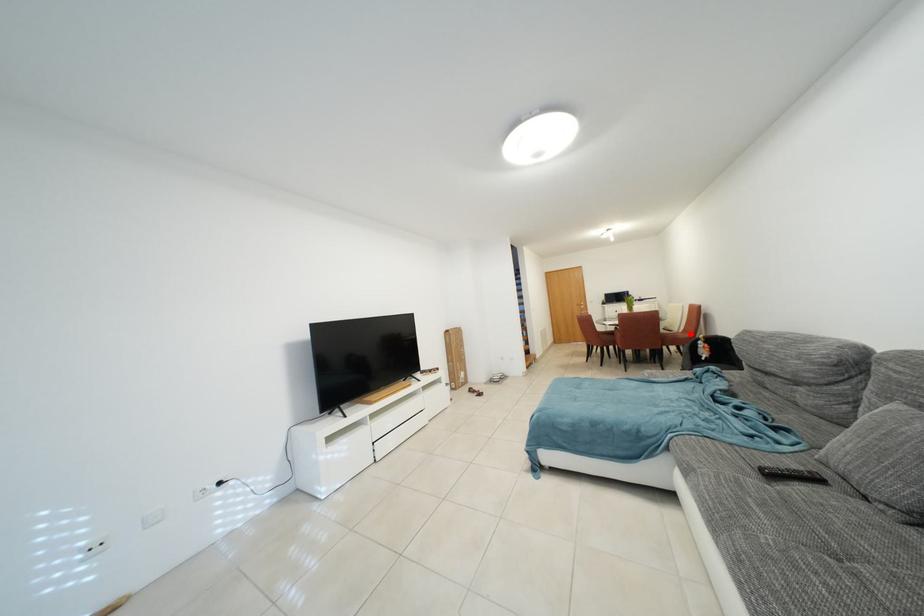
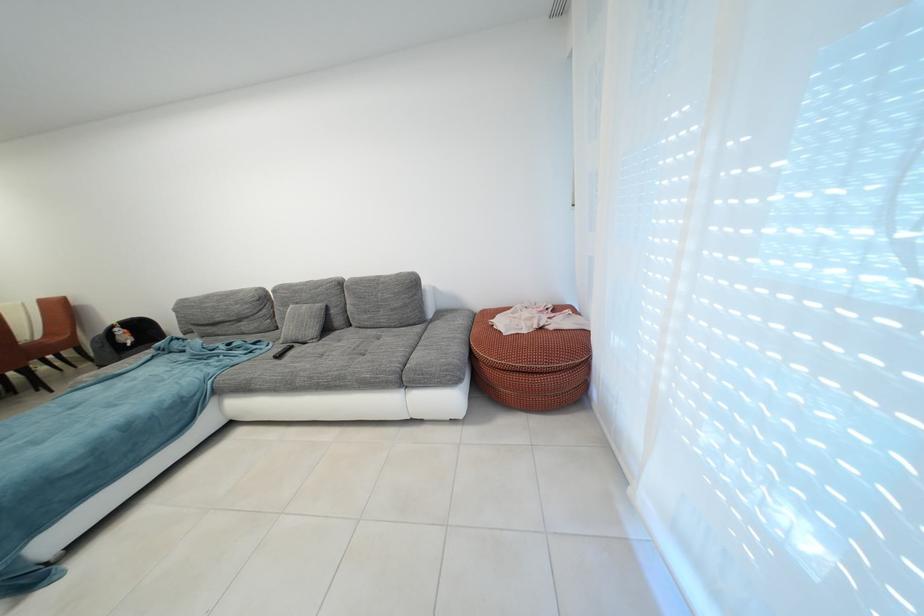
Question: A red point is marked in image1. In image2, is the corresponding 3D point closer to the camera or farther? Reply with the corresponding letter.

Choices:
 (A) The corresponding 3D point is closer.
 (B) The corresponding 3D point is farther.

Answer: (B)